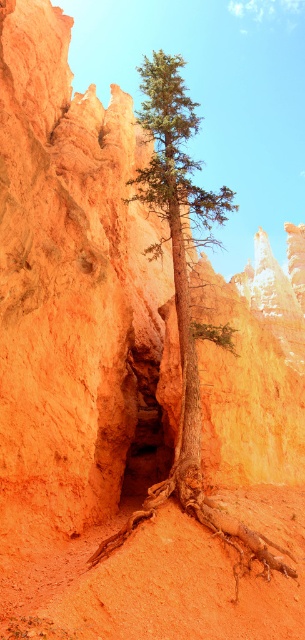
You are a hiker who has just arrived at the base of the orange rock formations. You spot the green matte tree at center in the distance. According to your map, the tree is located at coordinates point 0.372, 0.590. If you are standing at point 0.0, 0.0, in which general direction should you head to reach the tree?

The green matte tree at center is located at point (179, 237). Since you are at point (0, 0), you should head northeast to reach the tree.

You are a hiker standing in front of the green matte tree at center and the brown rough tree root at center. Which object is positioned more to the left?

The green matte tree at center is positioned more to the left than the brown rough tree root at center.